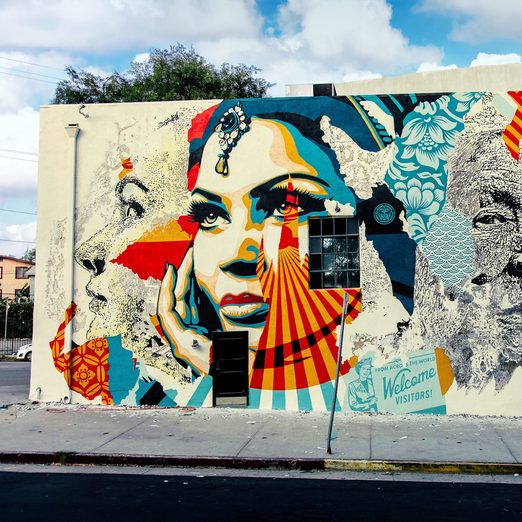
This screenshot has width=522, height=522. I want to click on gold leaf pattern on red paint, so click(81, 367).